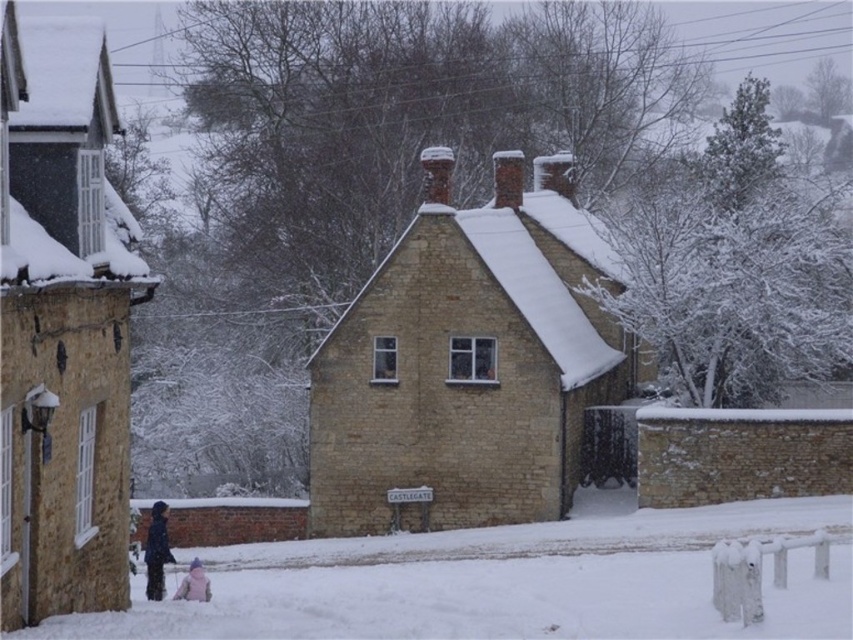
Is white fluffy snow at lower center further to the viewer compared to dark blue jacket at lower left?

No.

The width and height of the screenshot is (853, 640). In order to click on white fluffy snow at lower center in this screenshot , I will do `click(500, 582)`.

Identify the location of white fluffy snow at lower center. (500, 582).

In the scene shown: Does dark blue jacket at lower left have a larger size compared to pink fabric at lower center?

Yes.

Between dark blue jacket at lower left and pink fabric at lower center, which one is positioned higher?

dark blue jacket at lower left

Does point (161, 568) come behind point (192, 563)?

Yes, it is.

Image resolution: width=853 pixels, height=640 pixels. In order to click on dark blue jacket at lower left in this screenshot , I will do `click(155, 550)`.

Is point (341, 552) positioned in front of point (195, 566)?

That is False.

Where is `white fluffy snow at lower center`? This screenshot has width=853, height=640. white fluffy snow at lower center is located at coordinates (500, 582).

Image resolution: width=853 pixels, height=640 pixels. What are the coordinates of `white fluffy snow at lower center` in the screenshot? It's located at (500, 582).